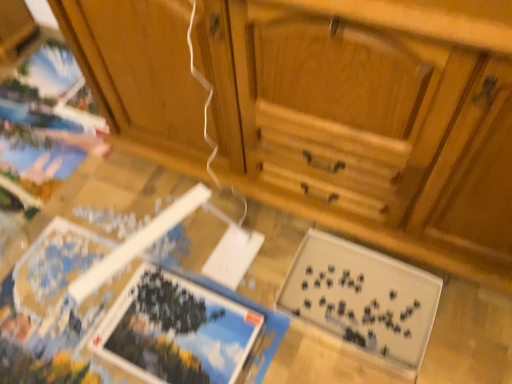
Where is `vacant area on top of wooden puzzle pieces at lower center (from a real-world perspective)`? vacant area on top of wooden puzzle pieces at lower center (from a real-world perspective) is located at coordinates (173, 233).